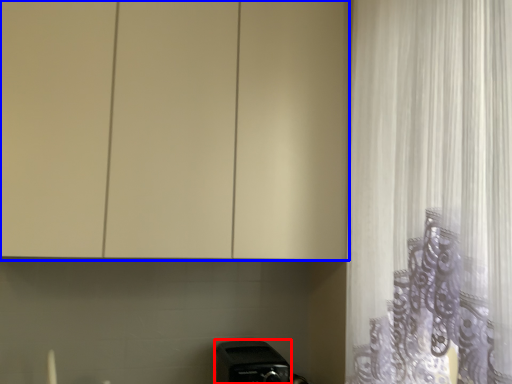
Question: Which object is further to the camera taking this photo, appliance (highlighted by a red box) or cabinetry (highlighted by a blue box)?

Choices:
 (A) appliance
 (B) cabinetry

Answer: (A)